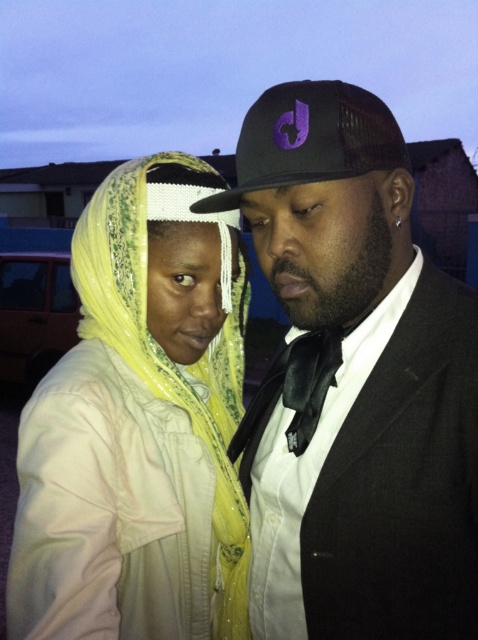
Question: Among these points, which one is farthest from the camera?

Choices:
 (A) (322, 528)
 (B) (364, 93)

Answer: (A)

Question: Which object appears farthest from the camera in this image?

Choices:
 (A) black matte hat at center
 (B) black mesh baseball cap at center
 (C) yellow fabric headscarf at left

Answer: (B)

Question: Does black matte hat at center have a greater width compared to yellow fabric headscarf at left?

Choices:
 (A) no
 (B) yes

Answer: (B)

Question: Which of the following is the closest to the observer?

Choices:
 (A) (368, 106)
 (B) (121, 193)
 (C) (289, 577)

Answer: (A)

Question: From the image, what is the correct spatial relationship of black matte hat at center in relation to yellow fabric headscarf at left?

Choices:
 (A) below
 (B) above

Answer: (B)

Question: Does yellow fabric headscarf at left have a lesser width compared to black mesh baseball cap at center?

Choices:
 (A) yes
 (B) no

Answer: (B)